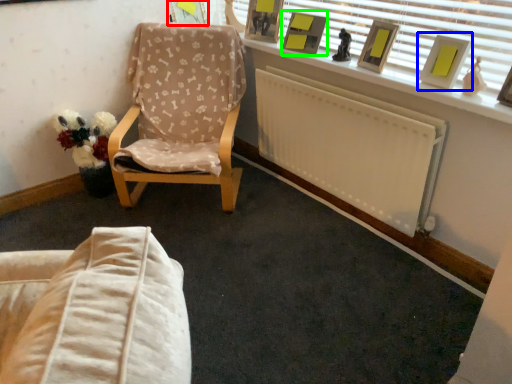
Question: Which object is the farthest from picture frame (highlighted by a red box)? Choose among these: picture frame (highlighted by a blue box) or picture frame (highlighted by a green box).

Choices:
 (A) picture frame
 (B) picture frame

Answer: (A)